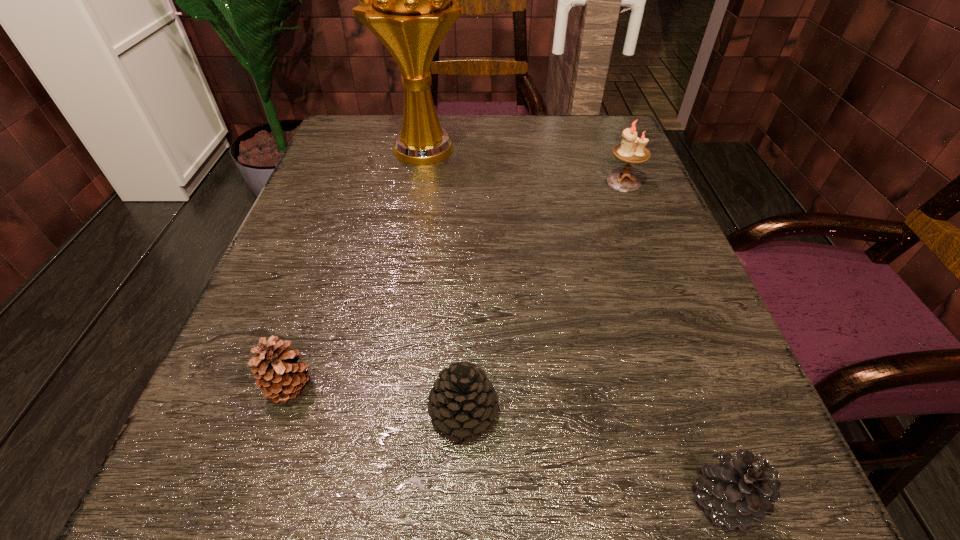
At what (x,y) coordinates should I click in order to perform the action: click on vacant position located 0.310m on the back of the nearest pinecone. Please return your answer as a coordinate pair (x, y). Looking at the image, I should click on (642, 273).

You are a GUI agent. You are given a task and a screenshot of the screen. Output one action in this format:
    pyautogui.click(x=<x>, y=<y>)
    Task: Click on the object present at the far edge
    This screenshot has width=960, height=540.
    Given the screenshot: What is the action you would take?
    pyautogui.click(x=409, y=0)

Find the location of a particular element. The width and height of the screenshot is (960, 540). object that is at the near edge is located at coordinates (740, 491).

Image resolution: width=960 pixels, height=540 pixels. I want to click on trophy_cup that is at the left edge, so click(409, 0).

Locate an element on the screen. pinecone that is at the left edge is located at coordinates (278, 374).

The image size is (960, 540). Identify the location of candle holder that is at the right edge. (632, 149).

Identify the location of pinecone that is positioned at the right edge. The image size is (960, 540). (740, 491).

The width and height of the screenshot is (960, 540). In order to click on object at the far left corner in this screenshot , I will do `click(409, 0)`.

Locate an element on the screen. Image resolution: width=960 pixels, height=540 pixels. object present at the near right corner is located at coordinates (740, 491).

In the image, there is a desktop. Identify the location of blank space at the far edge. (494, 119).